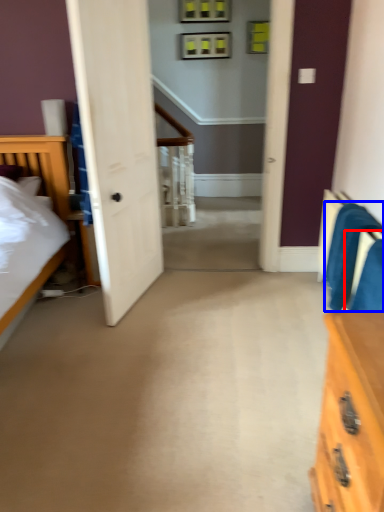
Question: Among these objects, which one is nearest to the camera, armchair (highlighted by a red box) or armchair (highlighted by a blue box)?

Choices:
 (A) armchair
 (B) armchair

Answer: (A)